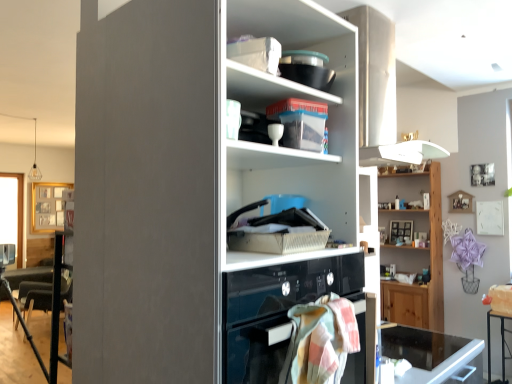
Question: From a real-world perspective, does pastel plaid towel at lower center stand above translucent plastic container at upper center, arranged as the first shelf when viewed from the front?

Choices:
 (A) yes
 (B) no

Answer: (B)

Question: Can you confirm if pastel plaid towel at lower center is positioned to the left of translucent plastic container at upper center, which is counted as the 1th shelf, starting from the left?

Choices:
 (A) yes
 (B) no

Answer: (B)

Question: From the image's perspective, would you say pastel plaid towel at lower center is positioned over translucent plastic container at upper center, the 2th shelf viewed from the back?

Choices:
 (A) no
 (B) yes

Answer: (A)

Question: Is pastel plaid towel at lower center further to camera compared to translucent plastic container at upper center, arranged as the first shelf when viewed from the front?

Choices:
 (A) no
 (B) yes

Answer: (A)

Question: Is pastel plaid towel at lower center in contact with translucent plastic container at upper center, the 2th shelf viewed from the back?

Choices:
 (A) yes
 (B) no

Answer: (B)

Question: From the image's perspective, is wooden shelf at upper right, which is the 1th shelf in back-to-front order, located above or below pastel plaid towel at lower center?

Choices:
 (A) above
 (B) below

Answer: (B)

Question: Based on their sizes in the image, would you say wooden shelf at upper right, placed as the 1th shelf when sorted from bottom to top, is bigger or smaller than pastel plaid towel at lower center?

Choices:
 (A) small
 (B) big

Answer: (B)

Question: Considering their positions, is wooden shelf at upper right, which is the 2th shelf in front-to-back order, located in front of or behind pastel plaid towel at lower center?

Choices:
 (A) behind
 (B) front

Answer: (A)

Question: In terms of height, does wooden shelf at upper right, marked as the 1th shelf in a right-to-left arrangement, look taller or shorter compared to pastel plaid towel at lower center?

Choices:
 (A) tall
 (B) short

Answer: (A)

Question: In terms of size, does pastel plaid towel at lower center appear bigger or smaller than wooden shelf at upper right, which is the 1th shelf in back-to-front order?

Choices:
 (A) small
 (B) big

Answer: (A)

Question: From the image's perspective, is pastel plaid towel at lower center above or below wooden shelf at upper right, which is the 2th shelf in front-to-back order?

Choices:
 (A) below
 (B) above

Answer: (B)

Question: In terms of width, does pastel plaid towel at lower center look wider or thinner when compared to wooden shelf at upper right, acting as the second shelf starting from the top?

Choices:
 (A) thin
 (B) wide

Answer: (A)

Question: In the image, is pastel plaid towel at lower center on the left side or the right side of wooden shelf at upper right, placed as the 1th shelf when sorted from bottom to top?

Choices:
 (A) left
 (B) right

Answer: (A)

Question: Would you say black glass desk at lower right is to the left or to the right of pastel plaid towel at lower center in the picture?

Choices:
 (A) right
 (B) left

Answer: (A)

Question: Considering their positions, is black glass desk at lower right located in front of or behind pastel plaid towel at lower center?

Choices:
 (A) behind
 (B) front

Answer: (A)